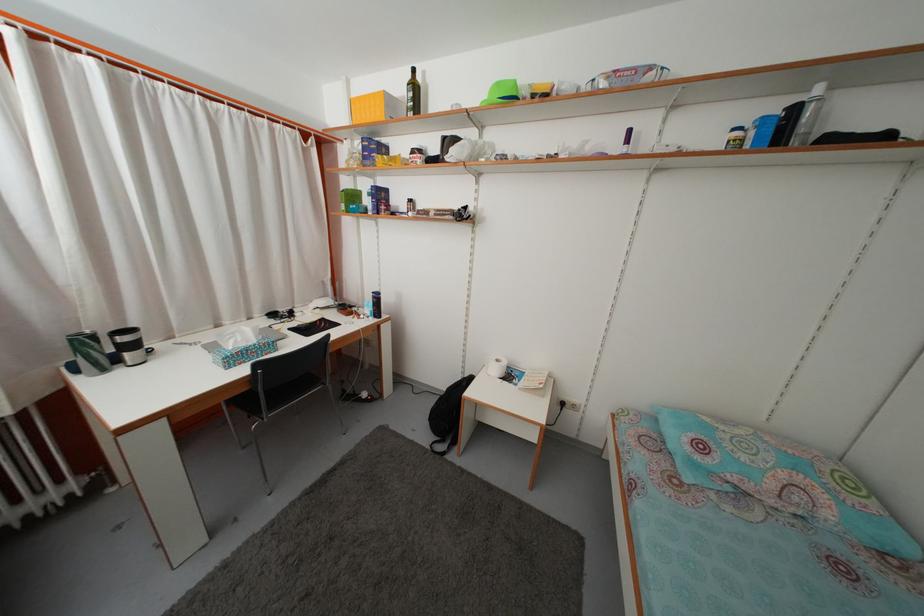
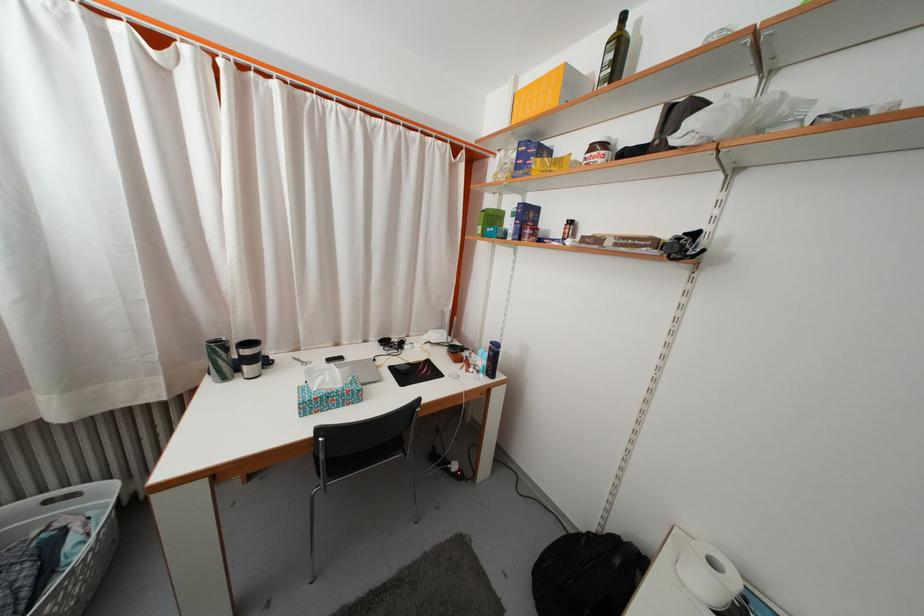
Find the pixel in the second image that matches (x=470, y=391) in the first image.

(623, 568)